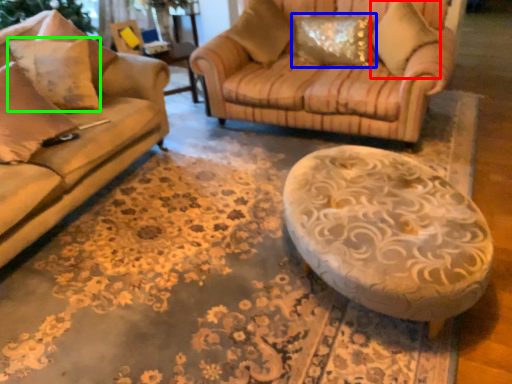
Question: Which is nearer to the pillow (highlighted by a red box)? pillow (highlighted by a blue box) or pillow (highlighted by a green box).

Choices:
 (A) pillow
 (B) pillow

Answer: (A)